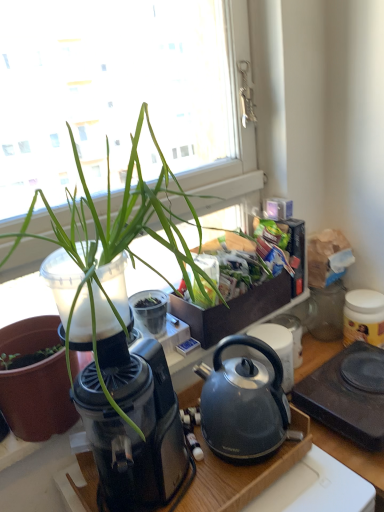
The height and width of the screenshot is (512, 384). Describe the element at coordinates (347, 395) in the screenshot. I see `black plastic hot plate at lower right, the 3th appliance in the left-to-right sequence` at that location.

What is the approximate height of white plastic toaster at center, placed as the 3th appliance when sorted from right to left?

The height of white plastic toaster at center, placed as the 3th appliance when sorted from right to left, is 5.33 inches.

You are a GUI agent. You are given a task and a screenshot of the screen. Output one action in this format:
    pyautogui.click(x=<x>, y=<y>)
    Task: Click on the yellow matte jar at right, which is the 4th appliance from left to right
    The image size is (384, 512).
    Given the screenshot: What is the action you would take?
    pyautogui.click(x=363, y=317)

In order to face matte black pot at left, should I rotate leftwards or rightwards?

Rotate left and turn 20.738 degrees.

At what (x,y) coordinates should I click in order to perform the action: click on green leafy vegetables at upper right. Please return your answer as a coordinate pair (x, y). The height and width of the screenshot is (512, 384). Looking at the image, I should click on (245, 262).

The image size is (384, 512). What do you see at coordinates (135, 423) in the screenshot?
I see `transparent plastic coffee machine at left` at bounding box center [135, 423].

This screenshot has height=512, width=384. Find the location of `green leafy plant at upper left`. green leafy plant at upper left is located at coordinates (115, 227).

How different are the orientations of satin black kettle at center and black plastic hot plate at lower right, arranged as the second appliance when viewed from the right, in degrees?

The angle between the facing direction of satin black kettle at center and the facing direction of black plastic hot plate at lower right, arranged as the second appliance when viewed from the right, is 1.12 degrees.

Is point (204, 398) farther from viewer compared to point (370, 424)?

No, (204, 398) is in front of (370, 424).

From the image's perspective, is satin black kettle at center on top of black plastic hot plate at lower right, arranged as the second appliance when viewed from the right?

Yes, from the image's perspective, satin black kettle at center is over black plastic hot plate at lower right, arranged as the second appliance when viewed from the right.

Which is closer to the camera, (285, 332) or (240, 343)?

Positioned in front is point (240, 343).

From a real-world perspective, is matte black kettle at center, the first appliance viewed from the left, physically below satin black kettle at center?

Yes, from a real-world perspective, matte black kettle at center, the first appliance viewed from the left, is below satin black kettle at center.

From the image's perspective, which is above, matte black kettle at center, the 4th appliance when ordered from right to left, or satin black kettle at center?

satin black kettle at center appears higher in the image.

Is green leafy plant at upper left taller than transparent plastic coffee machine at left?

Yes.

Considering the relative sizes of green leafy plant at upper left and transparent plastic coffee machine at left in the image provided, is green leafy plant at upper left wider than transparent plastic coffee machine at left?

Yes, green leafy plant at upper left is wider than transparent plastic coffee machine at left.

From the image's perspective, which one is positioned lower, green leafy plant at upper left or transparent plastic coffee machine at left?

transparent plastic coffee machine at left appears lower in the image.

Considering the relative sizes of matte black kettle at center, the first appliance viewed from the left, and white plastic toaster at center, placed as the 3th appliance when sorted from right to left, in the image provided, is matte black kettle at center, the first appliance viewed from the left, taller than white plastic toaster at center, placed as the 3th appliance when sorted from right to left,?

Correct, matte black kettle at center, the first appliance viewed from the left, is much taller as white plastic toaster at center, placed as the 3th appliance when sorted from right to left.

Which is behind, matte black kettle at center, the 4th appliance when ordered from right to left, or white plastic toaster at center, placed as the 3th appliance when sorted from right to left?

white plastic toaster at center, placed as the 3th appliance when sorted from right to left, is further from the camera.

From the image's perspective, which one is positioned higher, matte black kettle at center, the 4th appliance when ordered from right to left, or white plastic toaster at center, placed as the 3th appliance when sorted from right to left?

white plastic toaster at center, placed as the 3th appliance when sorted from right to left, from the image's perspective.

Which is more distant, (272, 329) or (235, 234)?

Positioned behind is point (272, 329).

Considering the sizes of objects matte black kettle at center, the first appliance viewed from the left, and green leafy vegetables at upper right in the image provided, who is shorter, matte black kettle at center, the first appliance viewed from the left, or green leafy vegetables at upper right?

Standing shorter between the two is matte black kettle at center, the first appliance viewed from the left.

From the image's perspective, does matte black kettle at center, the 4th appliance when ordered from right to left, appear lower than green leafy vegetables at upper right?

Yes, from the image's perspective, matte black kettle at center, the 4th appliance when ordered from right to left, is below green leafy vegetables at upper right.

Is matte black kettle at center, the 4th appliance when ordered from right to left, not within green leafy vegetables at upper right?

That's correct, matte black kettle at center, the 4th appliance when ordered from right to left, is outside of green leafy vegetables at upper right.

Visually, is green leafy vegetables at upper right positioned to the left or to the right of green leafy plant at upper left?

From the image, it's evident that green leafy vegetables at upper right is to the right of green leafy plant at upper left.

Consider the image. From the image's perspective, is green leafy vegetables at upper right on green leafy plant at upper left?

Incorrect, from the image's perspective, green leafy vegetables at upper right is lower than green leafy plant at upper left.

In terms of size, does green leafy vegetables at upper right appear bigger or smaller than green leafy plant at upper left?

Clearly, green leafy vegetables at upper right is smaller in size than green leafy plant at upper left.

Are green leafy vegetables at upper right and green leafy plant at upper left far apart?

green leafy vegetables at upper right is near green leafy plant at upper left, not far away.

Is transparent plastic coffee machine at left not near green leafy plant at upper left?

They are positioned close to each other.

Between transparent plastic coffee machine at left and green leafy plant at upper left, which one has more height?

With more height is green leafy plant at upper left.

Which object is positioned more to the left, transparent plastic coffee machine at left or green leafy plant at upper left?

green leafy plant at upper left.

The height and width of the screenshot is (512, 384). Identify the location of the 4th appliance positioned below the satin black kettle at center (from a real-world perspective). (347, 395).

From the image's perspective, which appliance is the 1st one below the satin black kettle at center? Please provide its 2D coordinates.

[(278, 348)]

From the image, which object appears to be farther from green leafy plant at upper left, matte black kettle at center, the first appliance viewed from the left, or black plastic hot plate at lower right, the 3th appliance in the left-to-right sequence?

black plastic hot plate at lower right, the 3th appliance in the left-to-right sequence, lies further to green leafy plant at upper left than the other object.

When comparing their distances from black plastic hot plate at lower right, the 3th appliance in the left-to-right sequence, does white plastic toaster at center, placed as the 3th appliance when sorted from right to left, or satin black kettle at center seem closer?

satin black kettle at center.

Estimate the real-world distances between objects in this image. Which object is closer to matte black pot at left, transparent plastic coffee machine at left or satin black kettle at center?

transparent plastic coffee machine at left is positioned closer to the anchor matte black pot at left.

When comparing their distances from satin black kettle at center, does white plastic toaster at center, placed as the 3th appliance when sorted from right to left, or green leafy vegetables at upper right seem closer?

green leafy vegetables at upper right lies closer to satin black kettle at center than the other object.

When comparing their distances from satin black kettle at center, does transparent plastic coffee machine at left or green leafy vegetables at upper right seem closer?

The object closer to satin black kettle at center is transparent plastic coffee machine at left.

In the scene shown: Which object lies further to the anchor point white plastic toaster at center, placed as the 3th appliance when sorted from right to left, green leafy vegetables at upper right or satin black kettle at center?

Among the two, satin black kettle at center is located further to white plastic toaster at center, placed as the 3th appliance when sorted from right to left.

Estimate the real-world distances between objects in this image. Which object is closer to matte black pot at left, green leafy vegetables at upper right or satin black kettle at center?

satin black kettle at center lies closer to matte black pot at left than the other object.

Looking at the image, which one is located closer to white plastic toaster at center, which appears as the second appliance when viewed from the left, satin black kettle at center or black plastic hot plate at lower right, the 3th appliance in the left-to-right sequence?

Among the two, black plastic hot plate at lower right, the 3th appliance in the left-to-right sequence, is located nearer to white plastic toaster at center, which appears as the second appliance when viewed from the left.

Where is `kettle located between transparent plastic coffee machine at left and white plastic toaster at center, placed as the 3th appliance when sorted from right to left, in the depth direction`? The height and width of the screenshot is (512, 384). kettle located between transparent plastic coffee machine at left and white plastic toaster at center, placed as the 3th appliance when sorted from right to left, in the depth direction is located at coordinates (x=243, y=403).

Locate an element on the screen. This screenshot has height=512, width=384. coffee machine between matte black pot at left and satin black kettle at center in the horizontal direction is located at coordinates (135, 423).

Locate an element on the screen. This screenshot has width=384, height=512. kettle between green leafy plant at upper left and white plastic toaster at center, placed as the 3th appliance when sorted from right to left, along the z-axis is located at coordinates (243, 403).

Image resolution: width=384 pixels, height=512 pixels. What are the coordinates of `kettle between matte black pot at left and matte black kettle at center, the first appliance viewed from the left, from left to right` in the screenshot? It's located at (243, 403).